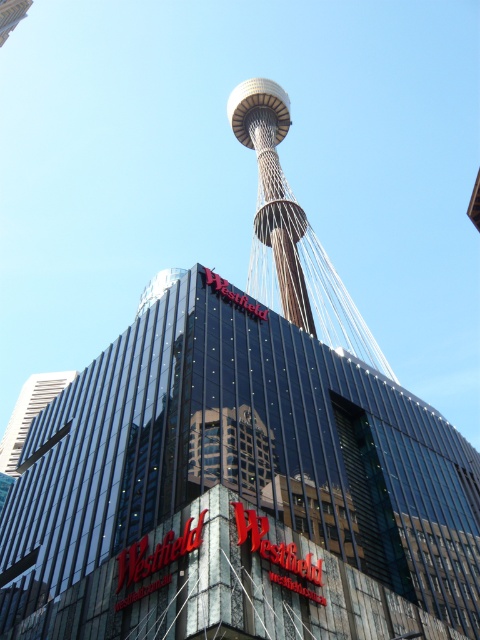
Does point (427, 428) come closer to viewer compared to point (242, 112)?

That is True.

Can you confirm if glassy steel tower at center is taller than gold metallic tower at center?

In fact, glassy steel tower at center may be shorter than gold metallic tower at center.

Image resolution: width=480 pixels, height=640 pixels. In order to click on glassy steel tower at center in this screenshot , I will do `click(237, 490)`.